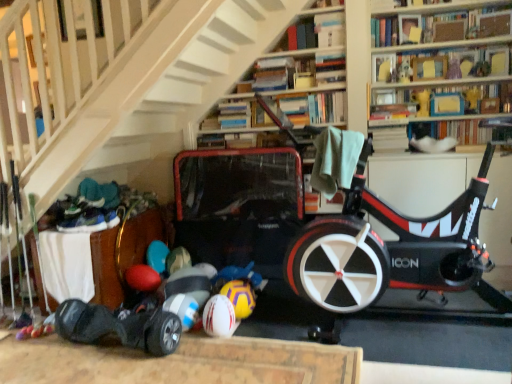
Question: Is yellowtexturebeach ball at lower center closer to camera compared to blue cardboard book at upper right, the third book positioned from the bottom?

Choices:
 (A) yes
 (B) no

Answer: (A)

Question: Can you confirm if yellowtexturebeach ball at lower center is shorter than blue cardboard book at upper right, the third book positioned from the bottom?

Choices:
 (A) yes
 (B) no

Answer: (B)

Question: Is yellowtexturebeach ball at lower center located outside blue cardboard book at upper right, the third book positioned from the bottom?

Choices:
 (A) yes
 (B) no

Answer: (A)

Question: Does yellowtexturebeach ball at lower center appear on the right side of blue cardboard book at upper right, the third book positioned from the bottom?

Choices:
 (A) no
 (B) yes

Answer: (A)

Question: Does yellowtexturebeach ball at lower center appear on the left side of blue cardboard book at upper right, the third book positioned from the bottom?

Choices:
 (A) no
 (B) yes

Answer: (B)

Question: Is point (471, 49) positioned closer to the camera than point (398, 107)?

Choices:
 (A) closer
 (B) farther

Answer: (A)

Question: From a real-world perspective, is matte cardboard book at upper right, marked as the third book in a top-to-bottom arrangement, positioned above or below blue cardboard book at upper right, the third book positioned from the bottom?

Choices:
 (A) above
 (B) below

Answer: (A)

Question: Is matte cardboard book at upper right, marked as the third book in a top-to-bottom arrangement, taller or shorter than blue cardboard book at upper right, which appears as the 4th book when viewed from the top?

Choices:
 (A) short
 (B) tall

Answer: (B)

Question: In terms of width, does matte cardboard book at upper right, which is the 4th book from bottom to top, look wider or thinner when compared to blue cardboard book at upper right, which appears as the 4th book when viewed from the top?

Choices:
 (A) thin
 (B) wide

Answer: (A)

Question: In terms of height, does blue cardboard book at upper right, which appears as the 4th book when viewed from the top, look taller or shorter compared to yellowtexturebeach ball at lower center?

Choices:
 (A) short
 (B) tall

Answer: (A)

Question: In terms of width, does blue cardboard book at upper right, which appears as the 4th book when viewed from the top, look wider or thinner when compared to yellowtexturebeach ball at lower center?

Choices:
 (A) thin
 (B) wide

Answer: (A)

Question: Is blue cardboard book at upper right, the third book positioned from the bottom, inside or outside of yellowtexturebeach ball at lower center?

Choices:
 (A) inside
 (B) outside

Answer: (B)

Question: Based on their positions, is blue cardboard book at upper right, the third book positioned from the bottom, located to the left or right of yellowtexturebeach ball at lower center?

Choices:
 (A) right
 (B) left

Answer: (A)

Question: Relative to hardcover book at upper center, the 1th book when ordered from top to bottom, is hardcover book at upper center, which is counted as the 5th book, starting from the top, in front or behind?

Choices:
 (A) front
 (B) behind

Answer: (B)

Question: In the image, is hardcover book at upper center, which is the second book in bottom-to-top order, on the left side or the right side of hardcover book at upper center, the 1th book when ordered from top to bottom?

Choices:
 (A) left
 (B) right

Answer: (A)